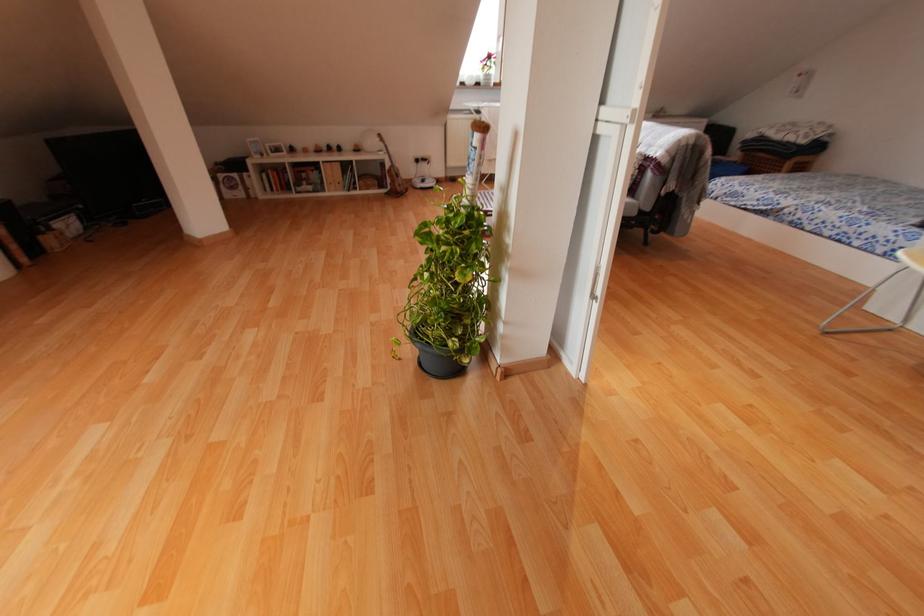
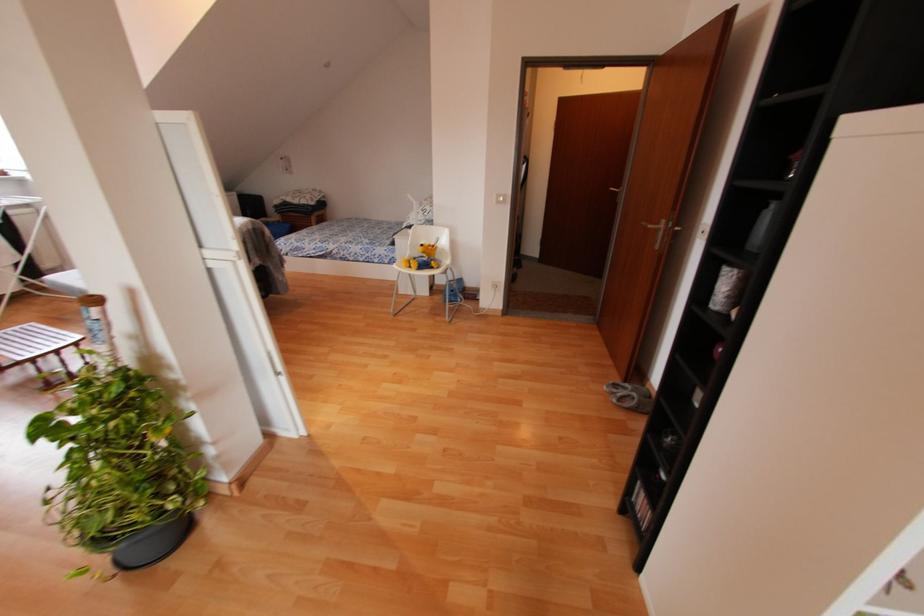
Find the pixel in the second image that matches (x=429, y=350) in the first image.

(140, 538)